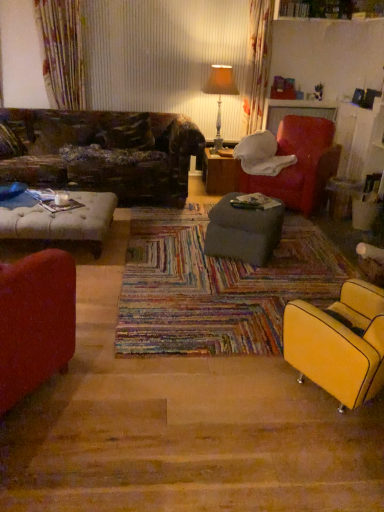
Where is `blank space to the left of matte yellow armchair at lower right, which ranks as the first chair in front-to-back order`? blank space to the left of matte yellow armchair at lower right, which ranks as the first chair in front-to-back order is located at coordinates (255, 394).